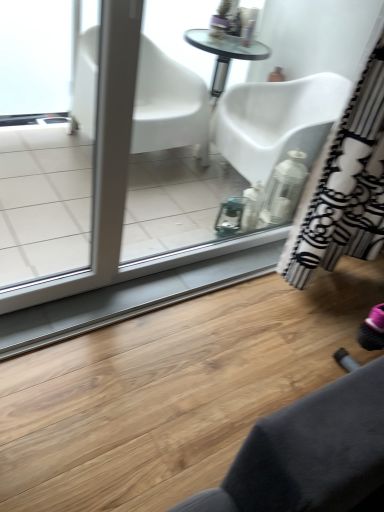
Question: Are black and white striped curtain at right and white glossy screen door at left making contact?

Choices:
 (A) no
 (B) yes

Answer: (A)

Question: Is black and white striped curtain at right completely or partially outside of white glossy screen door at left?

Choices:
 (A) no
 (B) yes

Answer: (B)

Question: Is black and white striped curtain at right facing towards white glossy screen door at left?

Choices:
 (A) yes
 (B) no

Answer: (B)

Question: Is black and white striped curtain at right wider than white glossy screen door at left?

Choices:
 (A) yes
 (B) no

Answer: (A)

Question: Can you confirm if black and white striped curtain at right is shorter than white glossy screen door at left?

Choices:
 (A) yes
 (B) no

Answer: (A)

Question: From the image's perspective, would you say black and white striped curtain at right is positioned over white glossy screen door at left?

Choices:
 (A) no
 (B) yes

Answer: (B)

Question: Is white glossy screen door at left positioned far away from black and white striped curtain at right?

Choices:
 (A) yes
 (B) no

Answer: (A)

Question: Would you say black and white striped curtain at right is part of white glossy screen door at left's contents?

Choices:
 (A) no
 (B) yes

Answer: (A)

Question: Is white glossy screen door at left placed right next to black and white striped curtain at right?

Choices:
 (A) yes
 (B) no

Answer: (B)

Question: Is white glossy screen door at left further to camera compared to black and white striped curtain at right?

Choices:
 (A) yes
 (B) no

Answer: (B)

Question: Is white glossy screen door at left shorter than black and white striped curtain at right?

Choices:
 (A) yes
 (B) no

Answer: (B)

Question: Can you confirm if white glossy screen door at left is taller than black and white striped curtain at right?

Choices:
 (A) yes
 (B) no

Answer: (A)

Question: From the image's perspective, is black and white striped curtain at right positioned above or below white glossy screen door at left?

Choices:
 (A) above
 (B) below

Answer: (A)